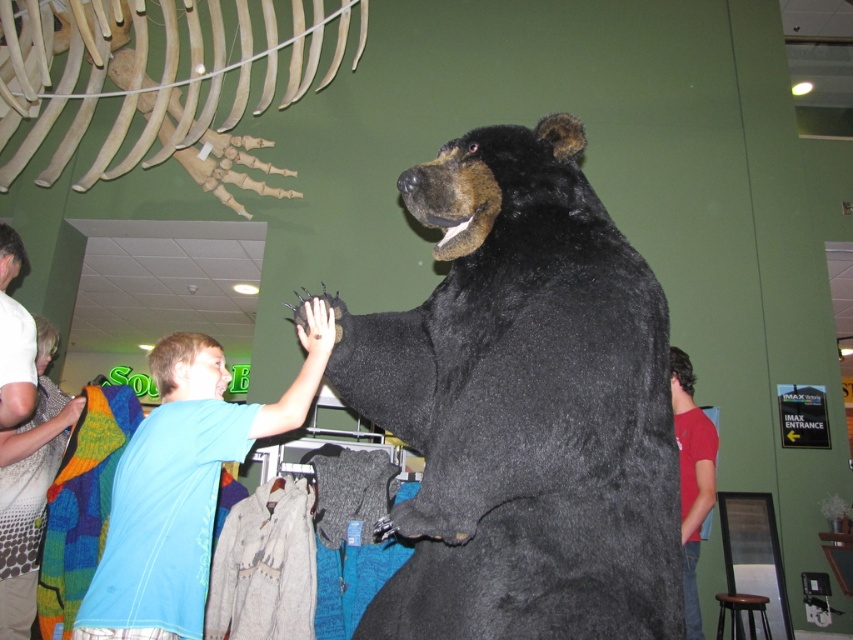
You are a museum visitor who wants to take a photo of the black plush bear at center without the red cotton shirt at right appearing in the frame. Is it possible to do so by moving sideways to the left?

The black plush bear at center might be wider than red cotton shirt at right, so moving sideways to the left may not ensure the red cotton shirt at right is out of frame since their widths are uncertain.